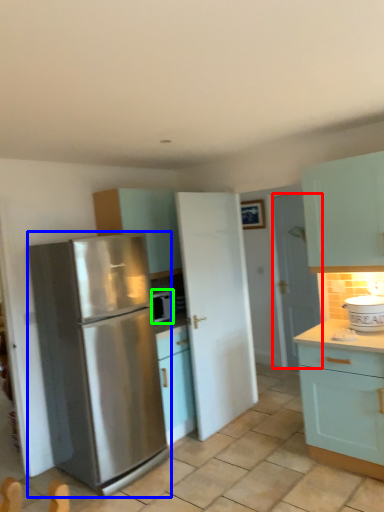
Question: Which object is the farthest from door (highlighted by a red box)? Choose among these: refrigerator (highlighted by a blue box) or appliance (highlighted by a green box).

Choices:
 (A) refrigerator
 (B) appliance

Answer: (A)